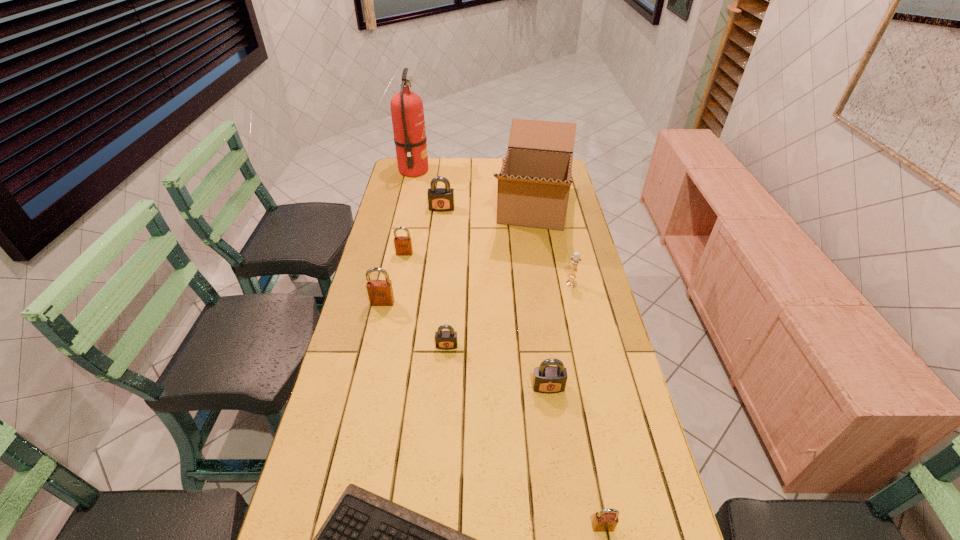
This screenshot has height=540, width=960. Identify the location of the tallest object. (407, 112).

At what (x,y) coordinates should I click in order to perform the action: click on red fire extinguisher. Please return your answer as a coordinate pair (x, y). The image size is (960, 540). Looking at the image, I should click on (407, 112).

Image resolution: width=960 pixels, height=540 pixels. I want to click on the second tallest object, so click(534, 183).

At what (x,y) coordinates should I click in order to perform the action: click on the farthest gray padlock. Please return your answer as a coordinate pair (x, y). This screenshot has height=540, width=960. Looking at the image, I should click on (439, 199).

Identify the location of the biggest gray padlock. (439, 199).

Locate an element on the screen. the second farthest brown padlock is located at coordinates (380, 292).

The width and height of the screenshot is (960, 540). I want to click on the fifth nearest object, so click(x=380, y=292).

This screenshot has width=960, height=540. In order to click on candle holder in this screenshot , I will do (x=576, y=259).

Where is `the fourth farthest object`? The height and width of the screenshot is (540, 960). the fourth farthest object is located at coordinates (403, 245).

At what (x,y) coordinates should I click in order to perform the action: click on the second biggest brown padlock. Please return your answer as a coordinate pair (x, y). This screenshot has height=540, width=960. Looking at the image, I should click on (403, 245).